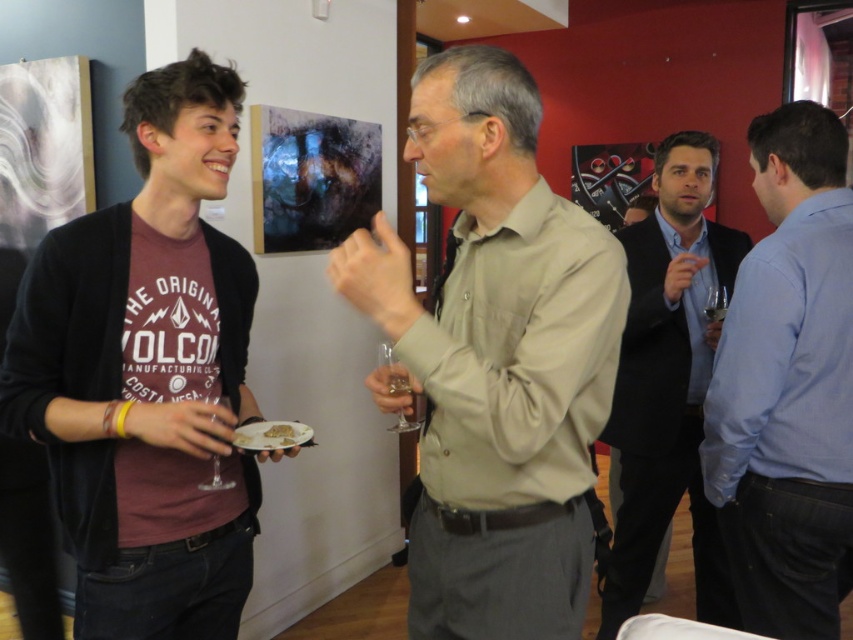
Question: Does white matte plate at lower center have a larger size compared to white creamy cake at center?

Choices:
 (A) no
 (B) yes

Answer: (B)

Question: Which of these objects is positioned farthest from the maroon cotton t-shirt at left?

Choices:
 (A) white matte plate at lower center
 (B) smooth black suit at right

Answer: (B)

Question: Estimate the real-world distances between objects in this image. Which object is farther from the smooth black suit at right?

Choices:
 (A) white matte plate at lower center
 (B) blue shirt at right
 (C) white creamy cake at center

Answer: (C)

Question: Is smooth black suit at right smaller than white creamy cake at center?

Choices:
 (A) yes
 (B) no

Answer: (B)

Question: Is maroon cotton t-shirt at left wider than smooth black suit at right?

Choices:
 (A) no
 (B) yes

Answer: (B)

Question: Which point is closer to the camera?

Choices:
 (A) blue shirt at right
 (B) white creamy cake at center
 (C) matte khaki shirt at center
 (D) smooth black suit at right

Answer: (C)